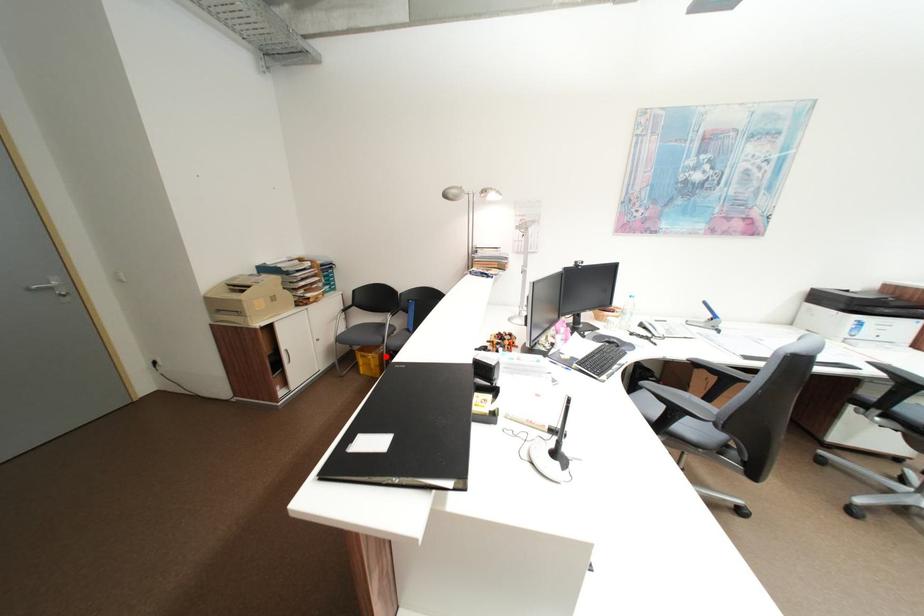
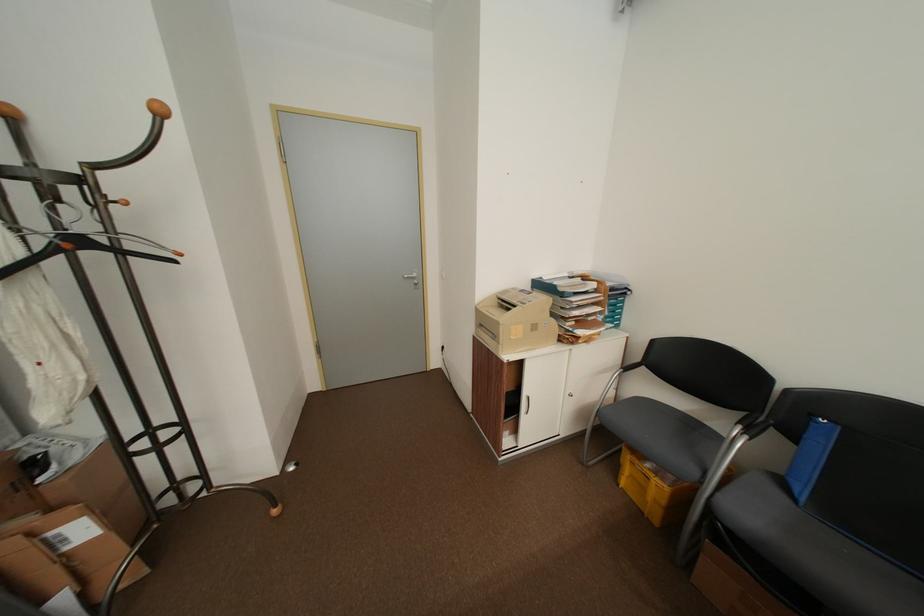
Locate, in the second image, the point that corresponds to the highlighted location in the first image.

(676, 488)